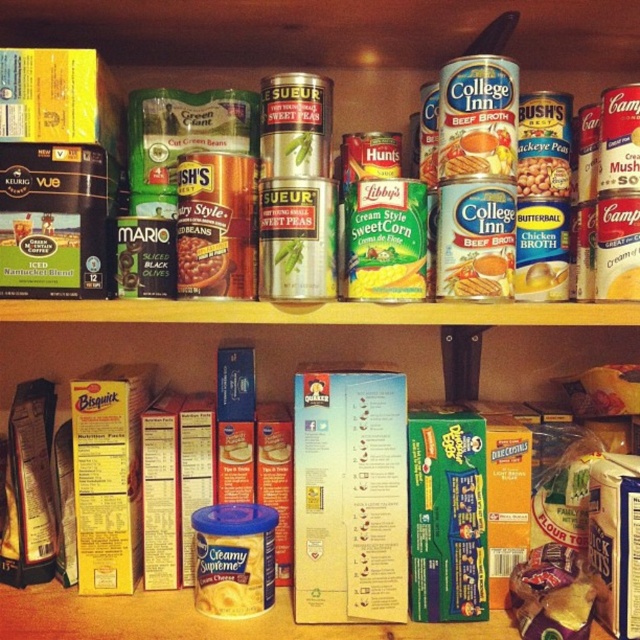
Between matte black olives at center and matte yellow can at right, which one has less height?

With less height is matte yellow can at right.

Does matte black olives at center come behind matte yellow can at right?

No, matte black olives at center is closer to the viewer.

Does point (198, 240) come in front of point (628, 296)?

That is True.

Find the location of a particular element. The height and width of the screenshot is (640, 640). matte black olives at center is located at coordinates (198, 260).

Does matte black olives at center have a larger size compared to matte gold can at center right?

No.

In the scene shown: Who is more distant from viewer, (186, 266) or (568, 182)?

Positioned behind is point (568, 182).

Image resolution: width=640 pixels, height=640 pixels. What are the coordinates of `matte black olives at center` in the screenshot? It's located at (198, 260).

Measure the distance from matte gold can at center right to matte yellow can at right.

A distance of 5.34 inches exists between matte gold can at center right and matte yellow can at right.

Is point (544, 182) positioned after point (627, 289)?

Yes, it is behind point (627, 289).

I want to click on matte gold can at center right, so click(x=541, y=177).